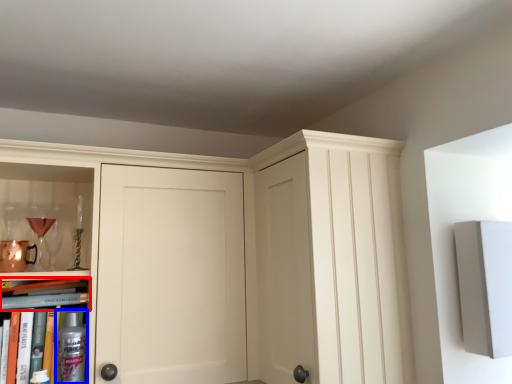
Question: Which of the following is the farthest to the observer, book (highlighted by a red box) or bottle (highlighted by a blue box)?

Choices:
 (A) book
 (B) bottle

Answer: (A)